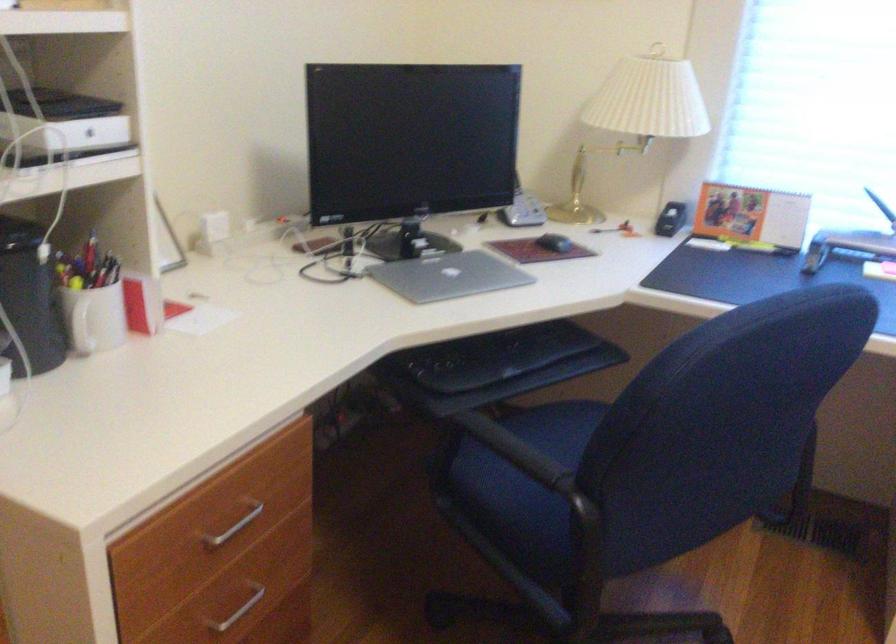
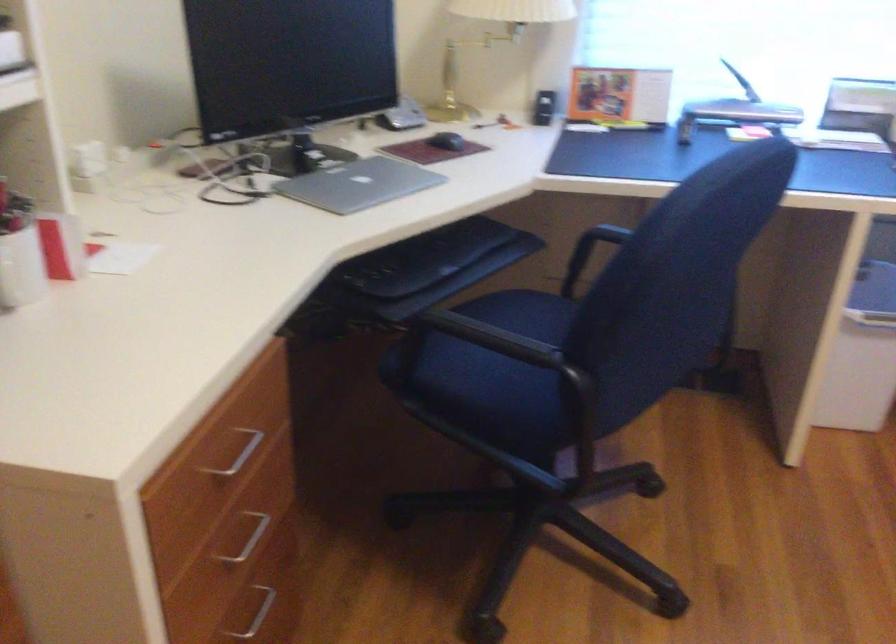
Find the pixel in the second image that matches point 497,442 in the first image.

(478, 339)